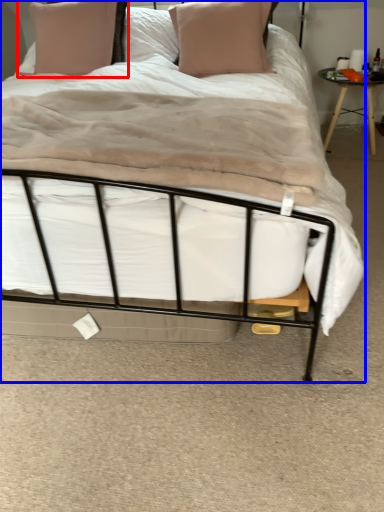
Question: Among these objects, which one is farthest to the camera, pillow (highlighted by a red box) or bed (highlighted by a blue box)?

Choices:
 (A) pillow
 (B) bed

Answer: (A)